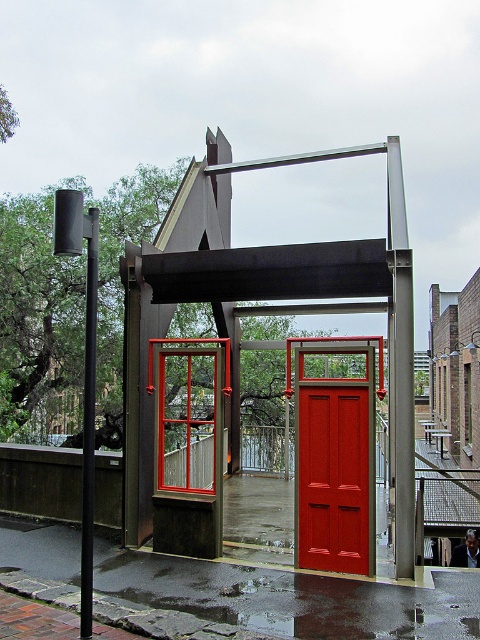
You are standing at point [267,300] in the image. What object are you directly facing?

You are directly facing the metallic red door at center located at point [267,300].

You are a painter standing at the entrance of the structure. You need to paint both the matte red door at center and the black metal pole at left. If your ladder can reach up to 10 feet, can you safely reach both objects from your current position without moving the ladder?

The matte red door at center is 8.21 feet away from the black metal pole at left. Since the ladder can reach up to 10 feet, you can safely reach both objects from your current position without moving the ladder because the distance between them is within the ladder reach.

You are an architect designing a new building and want to ensure that the matte red door at center and the black metal pole at left are proportionate. Given that the door must be wider than the pole, does the current design meet your requirements?

Yes, the current design meets the requirement because the matte red door at center is wider than the black metal pole at left, as stated in the description.